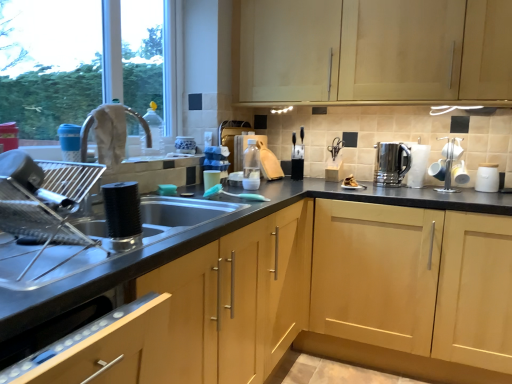
The height and width of the screenshot is (384, 512). Find the location of `vacant space that is to the left of translucent plastic bottle at center, which is the first bottle in right-to-left order`. vacant space that is to the left of translucent plastic bottle at center, which is the first bottle in right-to-left order is located at coordinates (226, 188).